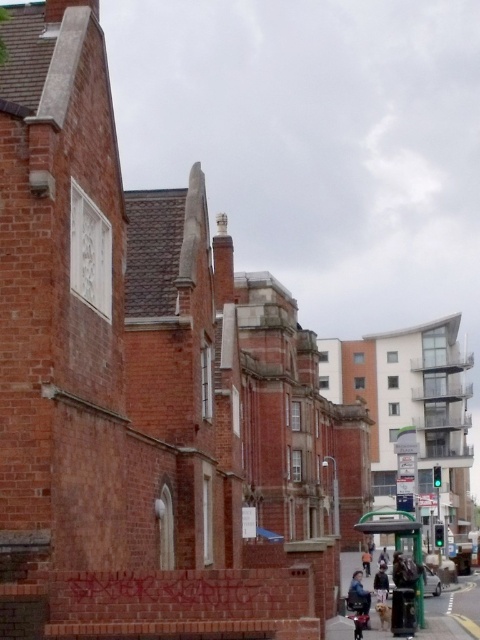
Who is positioned more to the left, blue denim jacket at lower right or shiny black motorcycle at lower right?

shiny black motorcycle at lower right

Between blue denim jacket at lower right and shiny black motorcycle at lower right, which one is positioned higher?

shiny black motorcycle at lower right

Locate an element on the screen. blue denim jacket at lower right is located at coordinates (359, 598).

Can you confirm if dark brown leather jacket at center is shorter than dark blue jeans at center?

Yes.

How distant is dark brown leather jacket at center from dark blue jeans at center?

32.79 meters

You are a GUI agent. You are given a task and a screenshot of the screen. Output one action in this format:
    pyautogui.click(x=<x>, y=<y>)
    Task: Click on the dark brown leather jacket at center
    This screenshot has height=640, width=480.
    Given the screenshot: What is the action you would take?
    pyautogui.click(x=381, y=582)

Does point (367, 556) lie behind point (383, 554)?

Yes.

Between orange cotton shirt at center and dark blue jeans at center, which one appears on the left side from the viewer's perspective?

orange cotton shirt at center

Where is `orange cotton shirt at center`? orange cotton shirt at center is located at coordinates (365, 561).

The image size is (480, 640). I want to click on orange cotton shirt at center, so click(365, 561).